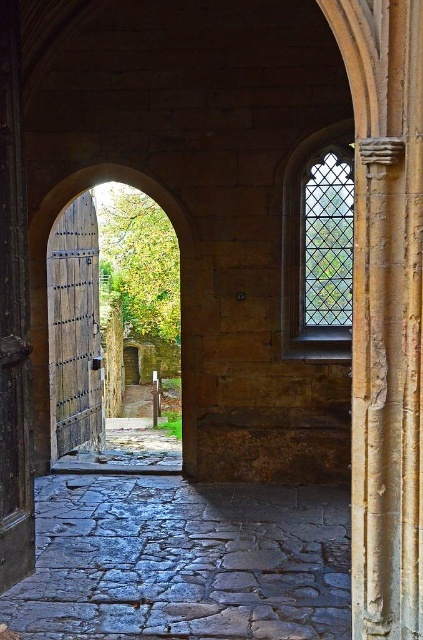
Question: Can you confirm if green stained glass window at upper right is positioned to the right of wooden door at center?

Choices:
 (A) no
 (B) yes

Answer: (B)

Question: Which point is farther from the camera taking this photo?

Choices:
 (A) (57, 308)
 (B) (315, 291)

Answer: (A)

Question: Is green stained glass window at upper right smaller than wooden door at center?

Choices:
 (A) no
 (B) yes

Answer: (B)

Question: Can you confirm if wooden door at center is positioned to the right of wooden gate at center?

Choices:
 (A) yes
 (B) no

Answer: (B)

Question: Among these objects, which one is nearest to the camera?

Choices:
 (A) wooden door at center
 (B) wooden gate at center

Answer: (B)

Question: Which of the following is the closest to the observer?

Choices:
 (A) (189, 224)
 (B) (65, 218)

Answer: (A)